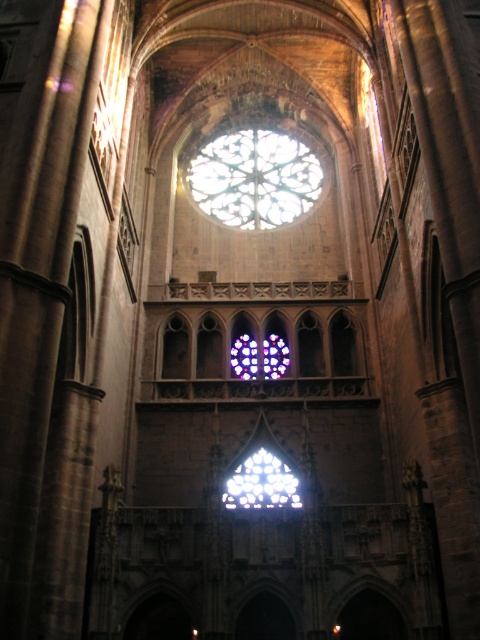
Question: Can you confirm if stained glass window at center is wider than clear glass stained glass at center?

Choices:
 (A) yes
 (B) no

Answer: (A)

Question: Which point appears farthest from the camera in this image?

Choices:
 (A) (287, 221)
 (B) (249, 460)

Answer: (A)

Question: Is stained glass window at center above clear glass stained glass at center?

Choices:
 (A) yes
 (B) no

Answer: (A)

Question: Is stained glass window at center positioned at the back of clear glass stained glass at center?

Choices:
 (A) no
 (B) yes

Answer: (B)

Question: Which of the following is the closest to the observer?

Choices:
 (A) clear glass stained glass at center
 (B) stained glass window at center

Answer: (A)

Question: Which of the following is the farthest from the observer?

Choices:
 (A) (312, 200)
 (B) (237, 506)

Answer: (A)